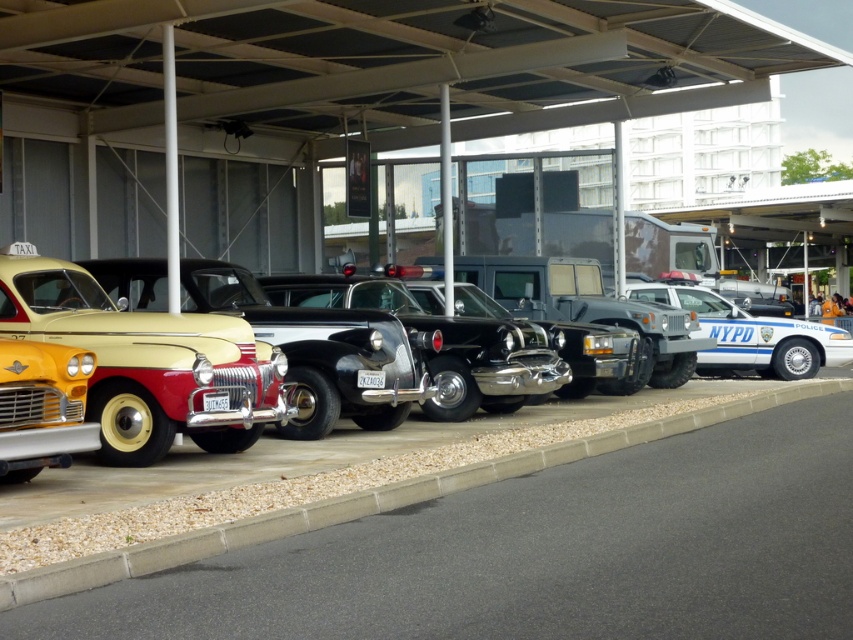
Question: Can you confirm if shiny chrome pickup truck at center is positioned to the left of white glossy police car at right?

Choices:
 (A) no
 (B) yes

Answer: (B)

Question: Considering the relative positions of gray concrete curb at lower center and white glossy police car at right in the image provided, where is gray concrete curb at lower center located with respect to white glossy police car at right?

Choices:
 (A) right
 (B) left

Answer: (B)

Question: Which point appears closest to the camera in this image?

Choices:
 (A) (114, 308)
 (B) (447, 484)
 (C) (593, 285)

Answer: (B)

Question: Considering the real-world distances, which object is closest to the matte yellow taxi at left?

Choices:
 (A) shiny chrome car at center
 (B) gray concrete curb at lower center

Answer: (A)

Question: Among these objects, which one is nearest to the camera?

Choices:
 (A) white glossy police car at right
 (B) yellow matte license plate at center

Answer: (B)

Question: Where is matte yellow taxi at left located in relation to yellow matte license plate at center in the image?

Choices:
 (A) right
 (B) left

Answer: (B)